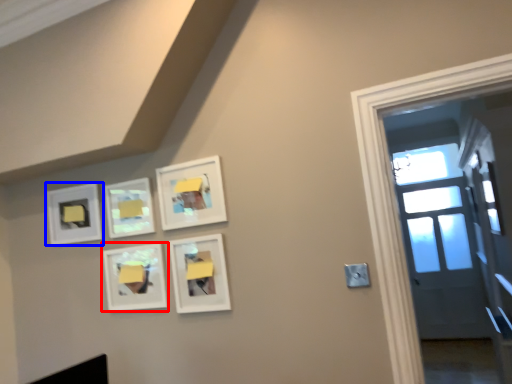
Question: Which point is further to the camera, picture frame (highlighted by a red box) or picture frame (highlighted by a blue box)?

Choices:
 (A) picture frame
 (B) picture frame

Answer: (B)